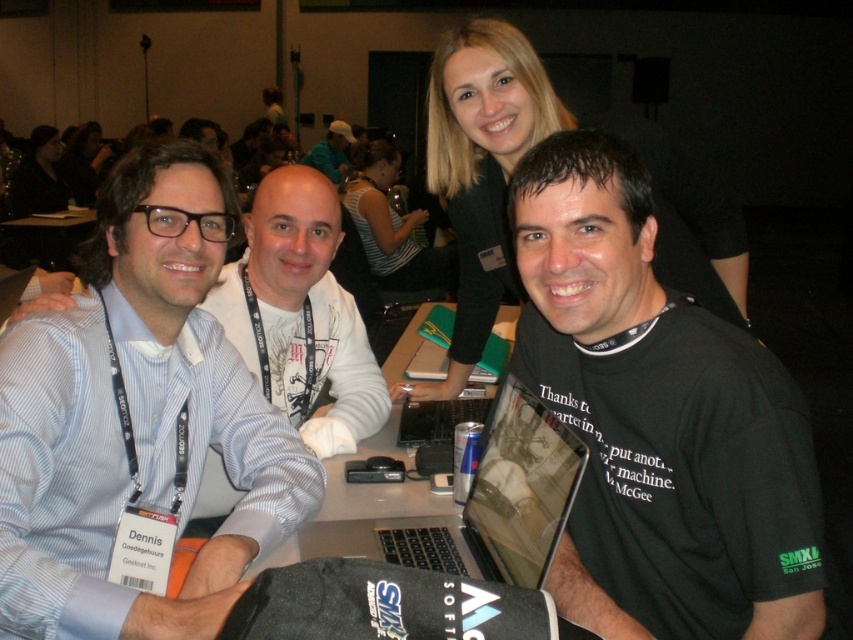
You are standing at point (209,163). The nearest person to you is 4.39 feet away. Is there anyone closer than 4.39 feet to you?

The nearest person to you is 4.39 feet away, so there is no one closer than that distance.

You are a photographer standing at the back of the room. You want to take a photo of the group so that both the point at (648, 573) and the point at (737, 236) are visible in the frame. Based on their positions, which point should you ensure is closer to the camera to avoid one blocking the other?

Point (648, 573) is in front of point (737, 236), so you should ensure the point at (648, 573) is closer to the camera to avoid blocking the other point.